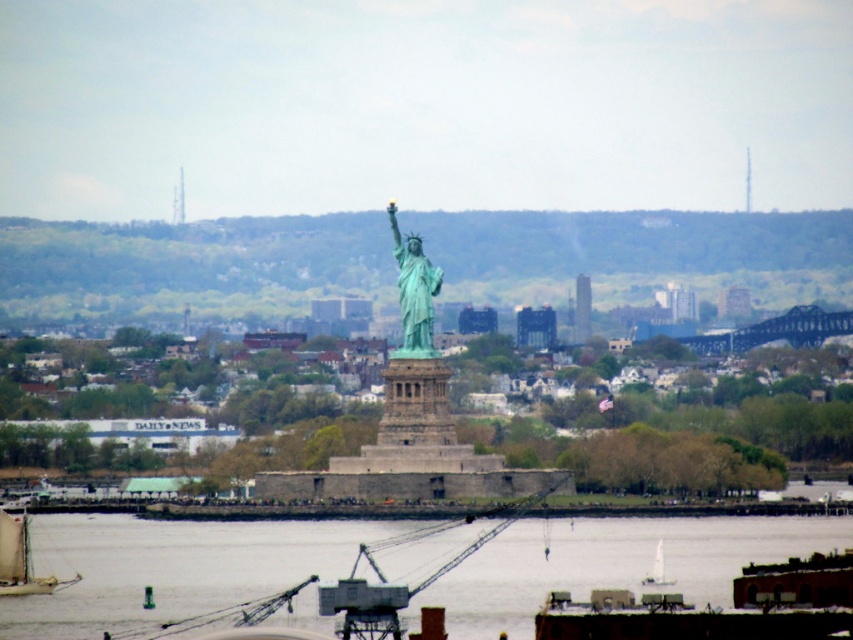
You are planning to transport a large crate that requires a vessel with a minimum width of 3 meters. You have access to both the wooden sailboat at lower left and the white plastic boat at lower center. Based on their widths, which boat would be suitable for your cargo?

The wooden sailboat at lower left might be wider than white plastic boat at lower center, so it is more likely to meet the required width of 3 meters for transporting the large crate.

You are standing on the riverbank and see the clear water at lower center and the wooden sailboat at lower left. Which object is closer to your current position?

The clear water at lower center is located below the wooden sailboat at lower left, so the wooden sailboat at lower left is closer to your position since it is above the water.

You are a tour guide explaining the Statue of Liberty to visitors. You notice a wooden sailboat at lower left and a white plastic boat at lower center in the image. Can you tell the visitors how far apart these two boats are?

The wooden sailboat at lower left is 130.58 meters away from the white plastic boat at lower center.